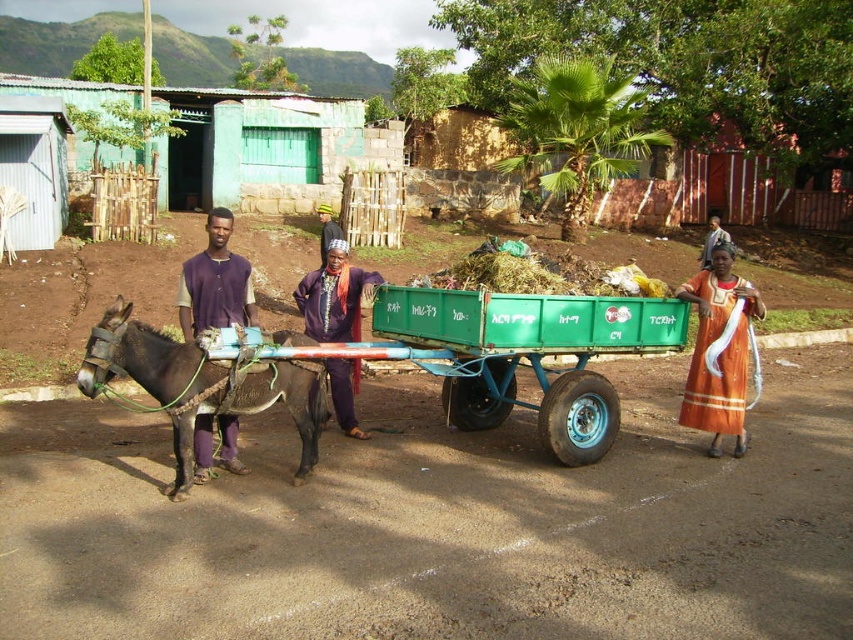
Between orange fabric dress at center and purple fabric at center, which one has more height?

With more height is orange fabric dress at center.

The width and height of the screenshot is (853, 640). What do you see at coordinates (718, 352) in the screenshot?
I see `orange fabric dress at center` at bounding box center [718, 352].

Is point (743, 289) positioned before point (334, 314)?

Yes, it is.

Where is `orange fabric dress at center`? orange fabric dress at center is located at coordinates (718, 352).

Measure the distance from purple fabric at center to orange fabric dress at right.

They are 10.75 meters apart.

Does purple fabric at center appear over orange fabric dress at right?

No, purple fabric at center is not above orange fabric dress at right.

Is point (354, 339) less distant than point (700, 252)?

That is True.

The image size is (853, 640). In order to click on purple fabric at center in this screenshot , I will do `click(334, 296)`.

Is point (202, 378) farther from viewer compared to point (738, 429)?

No, it is in front of (738, 429).

Locate an element on the screen. The height and width of the screenshot is (640, 853). dark brown leather mule at left is located at coordinates point(200,387).